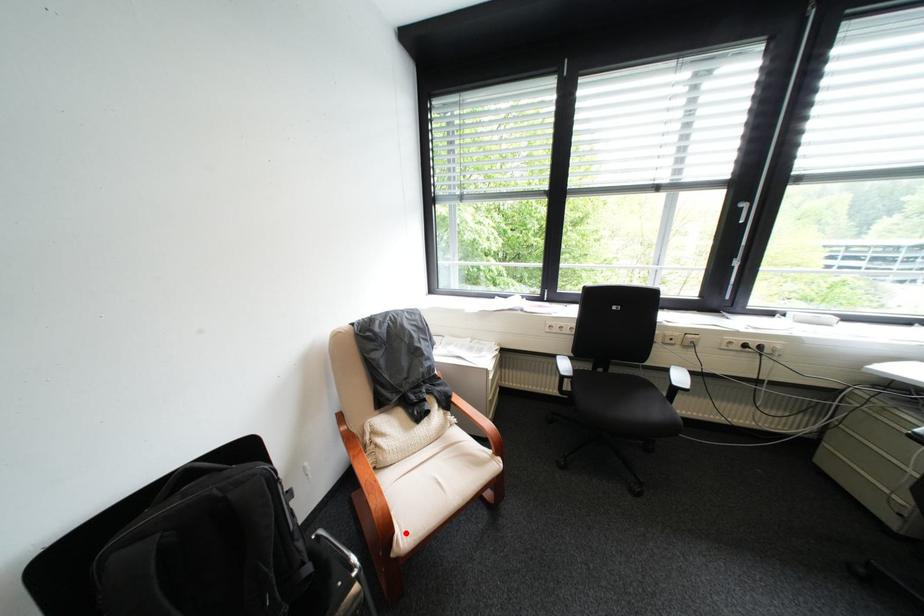
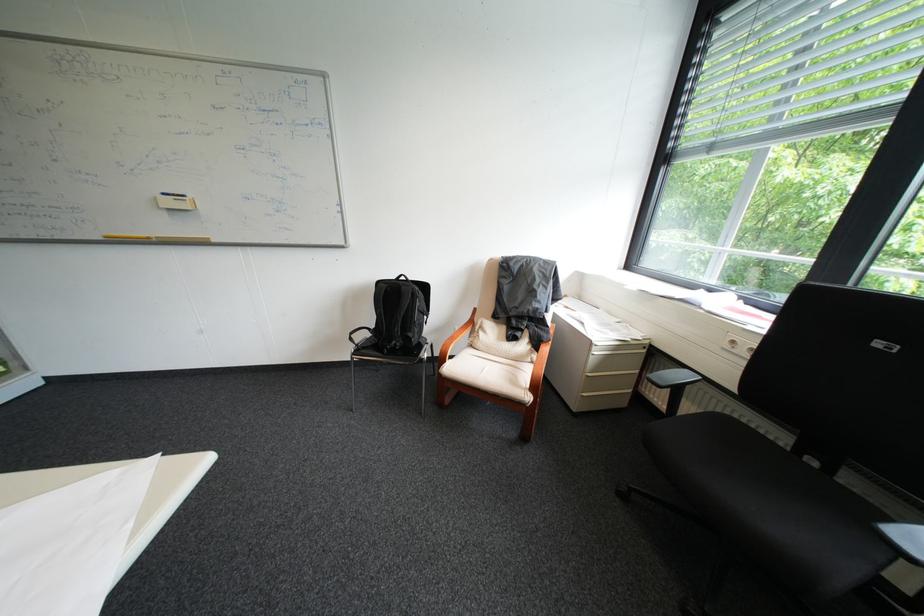
Find the pixel in the second image that matches the highlighted location in the first image.

(456, 363)